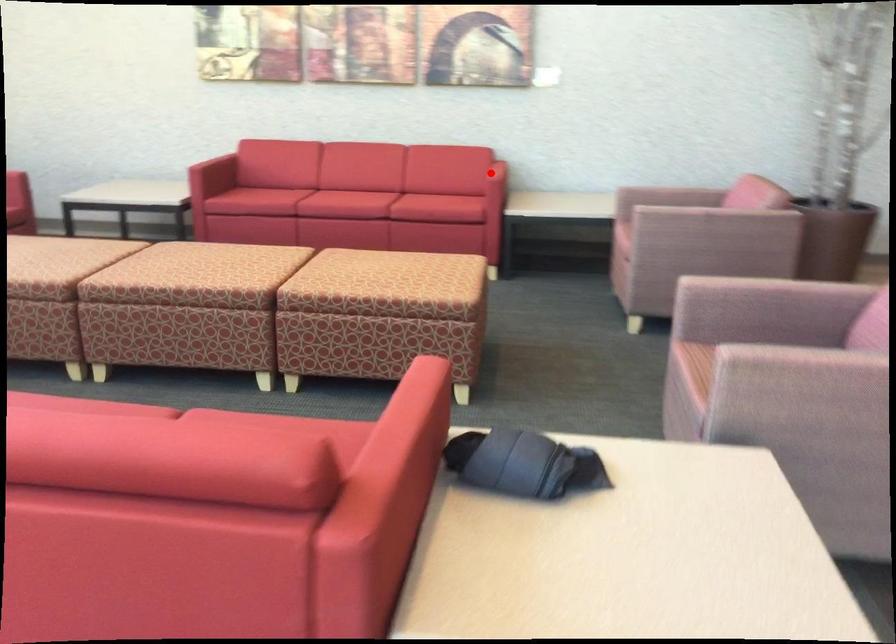
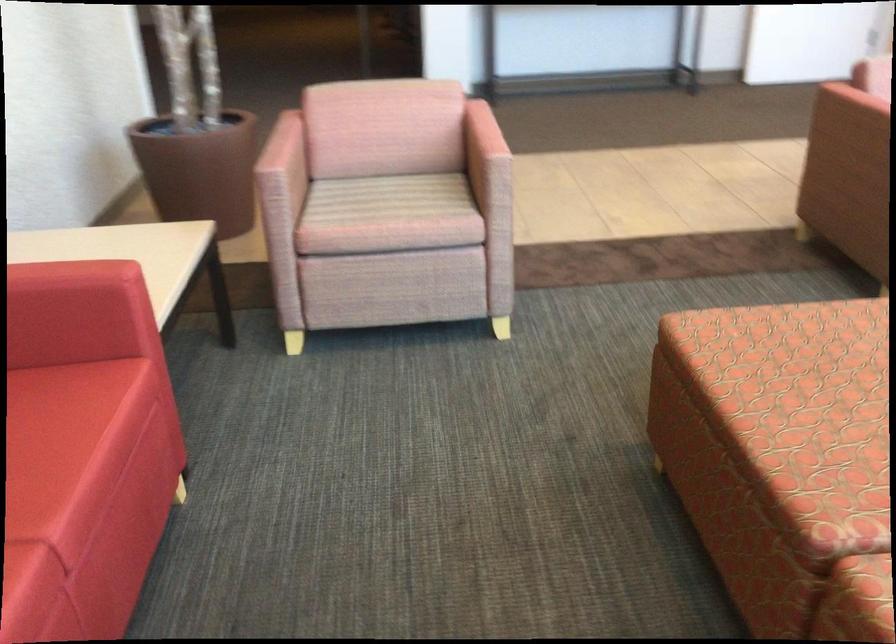
Question: I am providing you with two images of the same scene from different viewpoints. A red point is shown in image1. For the corresponding object point in image2, is it positioned nearer or farther from the camera?

Choices:
 (A) Nearer
 (B) Farther

Answer: (A)